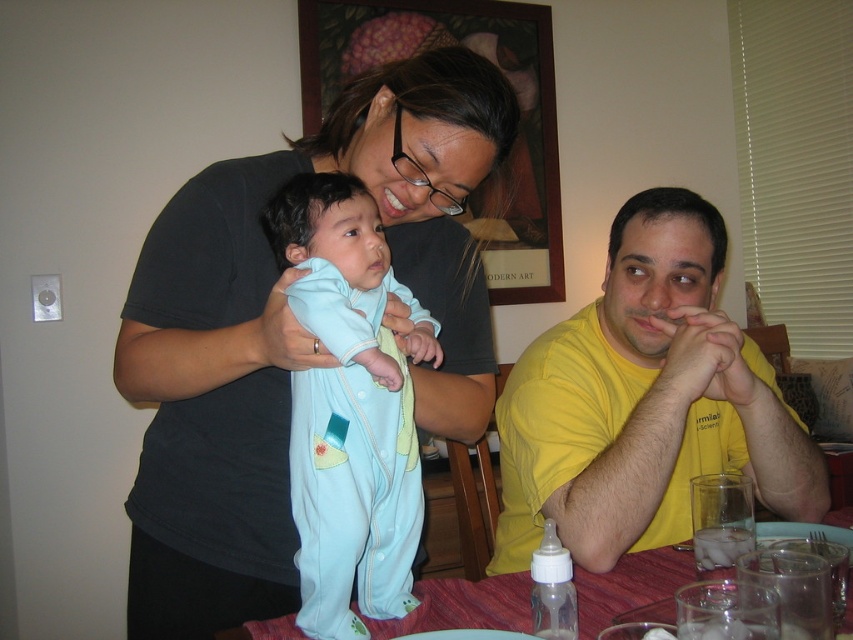
You are a housekeeper cleaning the dining table. You see the light blue fabric onesie at center and the red tablecloth at lower center. Which object takes up more area on the table?

The red tablecloth at lower center takes up more area on the table than the light blue fabric onesie at center.

You are a parent trying to ensure the safety of the baby. Given the scene described, can you confirm if the light blue fabric onesie at center is positioned above the red tablecloth at lower center?

Yes, the light blue fabric onesie at center is located above the red tablecloth at lower center, which means the baby is standing on the table where the red tablecloth is placed.

You are a photographer setting up a shoot in this dining area. You need to position a light source between the matte black shirt at upper left and the yellow cotton shirt at right. Which shirt should the light be closer to to ensure both are well lit?

The matte black shirt at upper left is closer to the viewer than the yellow cotton shirt at right, so the light should be positioned closer to the matte black shirt at upper left to balance the lighting between both shirts.